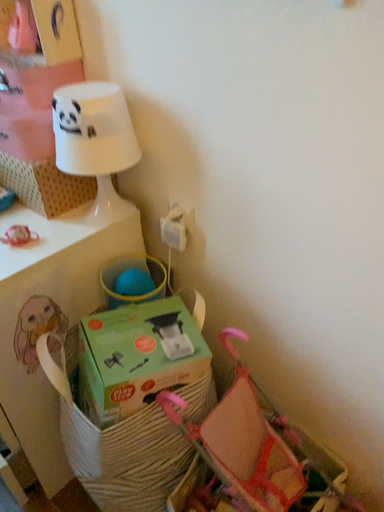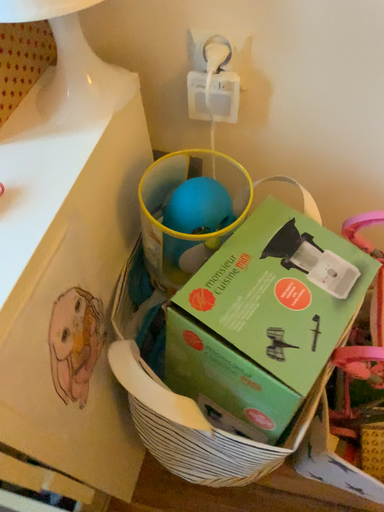
Question: Which way did the camera rotate in the video?

Choices:
 (A) rotated downward
 (B) rotated upward

Answer: (A)